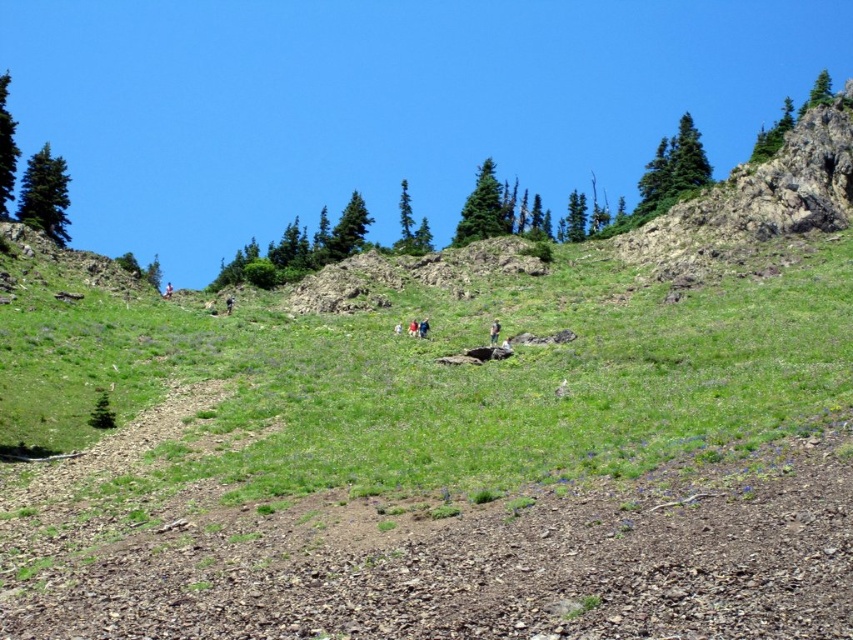
Which is above, green grassy at center or green fabric pants at center?

green grassy at center is above.

Identify the location of green grassy at center. (445, 380).

Which is above, green grassy at center or light brown fabric jacket at center?

Positioned higher is green grassy at center.

Does green grassy at center have a lesser height compared to light brown fabric jacket at center?

In fact, green grassy at center may be taller than light brown fabric jacket at center.

This screenshot has width=853, height=640. What do you see at coordinates (445, 380) in the screenshot?
I see `green grassy at center` at bounding box center [445, 380].

Where is `green grassy at center`? Image resolution: width=853 pixels, height=640 pixels. green grassy at center is located at coordinates (445, 380).

Is point (497, 321) closer to viewer compared to point (416, 330)?

That is True.

Does point (492, 332) lie in front of point (413, 330)?

Yes, it is in front of point (413, 330).

This screenshot has width=853, height=640. I want to click on green fabric pants at center, so click(494, 332).